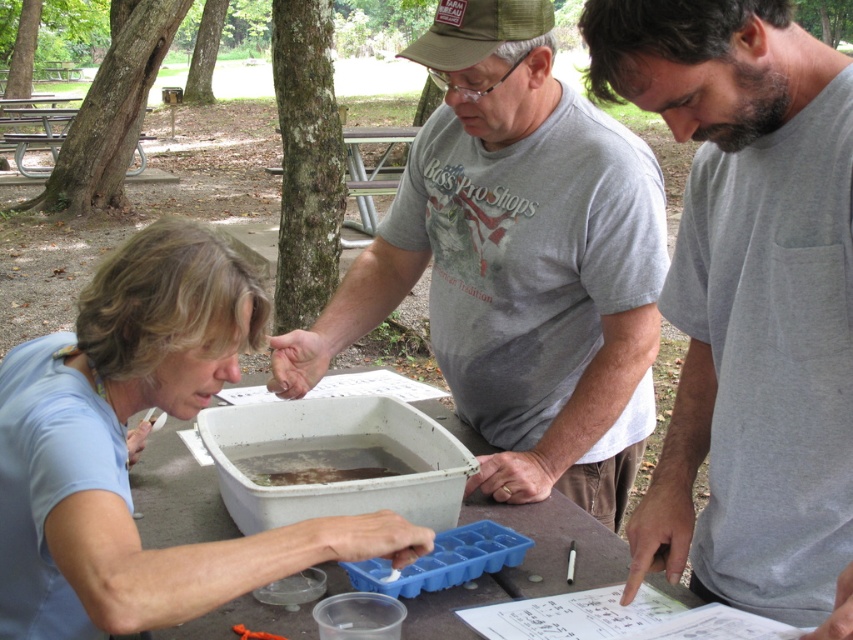
You are standing 10 feet away from the camera. You want to hand a tool to the gray cotton shirt at center. Can you reach them without moving?

The gray cotton shirt at center is 38.97 inches away from the camera. Since you are 10 feet away, which is 120 inches, the distance between you and the gray cotton shirt at center is 120 minus 38.97 equals 81.03 inches. The average human arm length is about 25 inches, so you cannot reach them without moving.

You are a photographer trying to capture a group photo of the gray cotton shirt at center and the light blue fabric at center. If you want to ensure both are in focus, which one should you focus on first to account for their sizes?

The gray cotton shirt at center is smaller than the light blue fabric at center, so you should focus on the gray cotton shirt at center first since smaller objects require closer attention to maintain focus.

You are a participant in this outdoor educational activity. You need to locate the gray cotton shirt at center and the white plastic table at center. Which one is positioned to the right of the other?

The gray cotton shirt at center is to the right of the white plastic table at center.